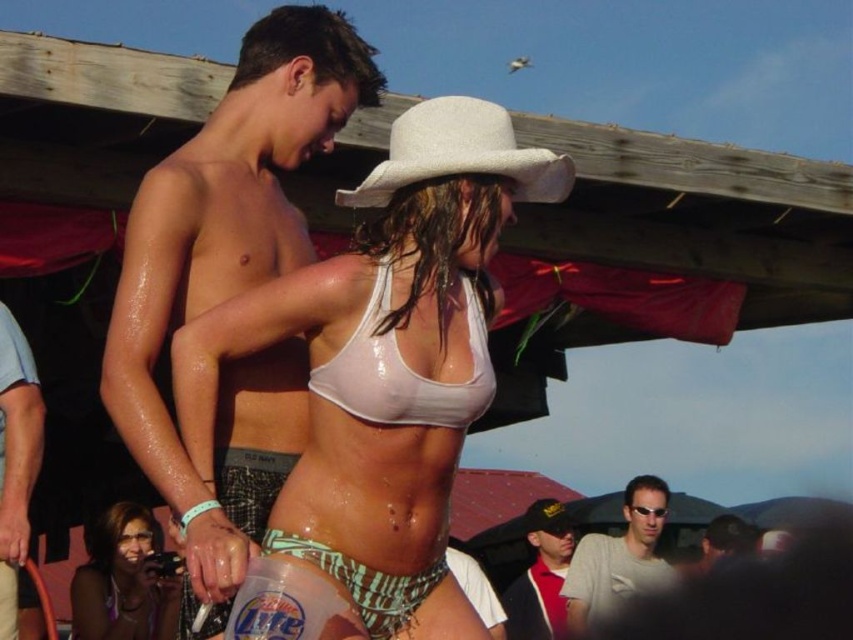
In the scene described, where is the shiny black skin at upper center located relative to the white straw cowboy hat at center?

The shiny black skin at upper center is located to the left of the white straw cowboy hat at center.

You are a photographer trying to capture a closeup of the gray fabric sunglasses at center and dark blue baseball cap at lower center. Which object should you zoom in on to avoid them being too small in the frame?

The gray fabric sunglasses at center might be wider than dark blue baseball cap at lower center, so you should zoom in on the gray fabric sunglasses at center to avoid them being too small in the frame.